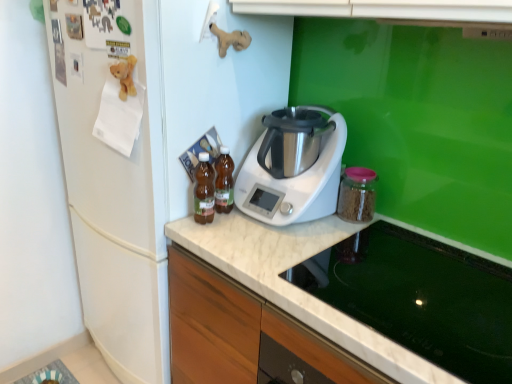
Question: From a real-world perspective, is transparent glass jar at right, the 4th kitchen appliance in the left-to-right sequence, on white matte refrigerator at left?

Choices:
 (A) no
 (B) yes

Answer: (B)

Question: Does transparent glass jar at right, which is the first kitchen appliance in right-to-left order, have a greater width compared to white matte refrigerator at left?

Choices:
 (A) yes
 (B) no

Answer: (B)

Question: Considering the relative positions of transparent glass jar at right, the 4th kitchen appliance in the left-to-right sequence, and white matte refrigerator at left in the image provided, is transparent glass jar at right, the 4th kitchen appliance in the left-to-right sequence, to the left of white matte refrigerator at left from the viewer's perspective?

Choices:
 (A) no
 (B) yes

Answer: (A)

Question: Considering the relative sizes of transparent glass jar at right, which is the first kitchen appliance in right-to-left order, and white matte refrigerator at left in the image provided, is transparent glass jar at right, which is the first kitchen appliance in right-to-left order, bigger than white matte refrigerator at left?

Choices:
 (A) no
 (B) yes

Answer: (A)

Question: Is transparent glass jar at right, the 4th kitchen appliance in the left-to-right sequence, facing towards white matte refrigerator at left?

Choices:
 (A) no
 (B) yes

Answer: (A)

Question: Visually, is transparent glass jar at right, the 4th kitchen appliance in the left-to-right sequence, positioned to the left or to the right of brown glass bottles at center, which is the 1th kitchen appliance in left-to-right order?

Choices:
 (A) left
 (B) right

Answer: (B)

Question: Considering the positions of transparent glass jar at right, which is the first kitchen appliance in right-to-left order, and brown glass bottles at center, which is the 1th kitchen appliance in left-to-right order, in the image, is transparent glass jar at right, which is the first kitchen appliance in right-to-left order, wider or thinner than brown glass bottles at center, which is the 1th kitchen appliance in left-to-right order,?

Choices:
 (A) wide
 (B) thin

Answer: (A)

Question: Is point (362, 170) closer or farther from the camera than point (201, 190)?

Choices:
 (A) farther
 (B) closer

Answer: (A)

Question: In the image, is transparent glass jar at right, the 4th kitchen appliance in the left-to-right sequence, positioned in front of or behind brown glass bottles at center, arranged as the 4th kitchen appliance when viewed from the right?

Choices:
 (A) front
 (B) behind

Answer: (B)

Question: Is point (250, 211) closer or farther from the camera than point (502, 324)?

Choices:
 (A) closer
 (B) farther

Answer: (B)

Question: From the image's perspective, is white plastic appliance at center, which is counted as the 2th kitchen appliance, starting from the right, positioned above or below glass stovetop at lower center?

Choices:
 (A) above
 (B) below

Answer: (A)

Question: From their relative heights in the image, would you say white plastic appliance at center, which is the third kitchen appliance in left-to-right order, is taller or shorter than glass stovetop at lower center?

Choices:
 (A) short
 (B) tall

Answer: (B)

Question: Considering the relative positions of white plastic appliance at center, which is the third kitchen appliance in left-to-right order, and glass stovetop at lower center in the image provided, is white plastic appliance at center, which is the third kitchen appliance in left-to-right order, to the left or to the right of glass stovetop at lower center?

Choices:
 (A) right
 (B) left

Answer: (B)

Question: Considering the relative positions of glass stovetop at lower center and white plastic appliance at center, which is the third kitchen appliance in left-to-right order, in the image provided, is glass stovetop at lower center to the left or to the right of white plastic appliance at center, which is the third kitchen appliance in left-to-right order,?

Choices:
 (A) left
 (B) right

Answer: (B)

Question: From a real-world perspective, is glass stovetop at lower center positioned above or below white plastic appliance at center, which is the third kitchen appliance in left-to-right order?

Choices:
 (A) above
 (B) below

Answer: (B)